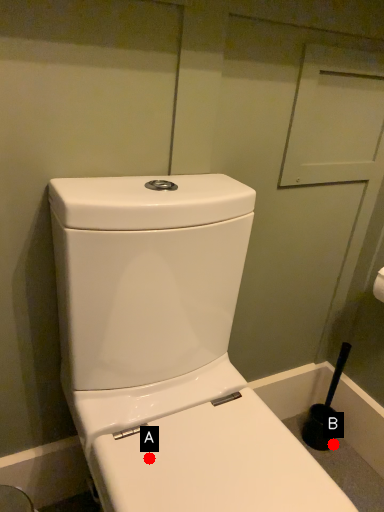
Question: Two points are circled on the image, labeled by A and B beside each circle. Which point is farther from the camera taking this photo?

Choices:
 (A) A is further
 (B) B is further

Answer: (B)